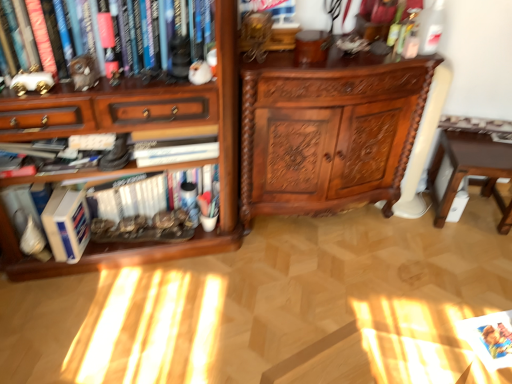
At what (x,y) coordinates should I click in order to perform the action: click on free point below brown wooden table at lower right (from a real-world perspective). Please return your answer as a coordinate pair (x, y). This screenshot has height=384, width=512. Looking at the image, I should click on (478, 213).